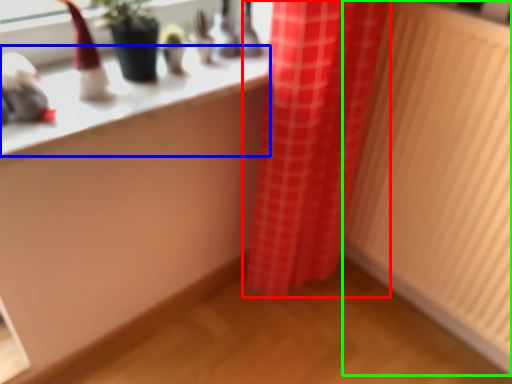
Question: Which object is the closest to the curtain (highlighted by a red box)? Choose among these: counter top (highlighted by a blue box) or radiator (highlighted by a green box).

Choices:
 (A) counter top
 (B) radiator

Answer: (B)